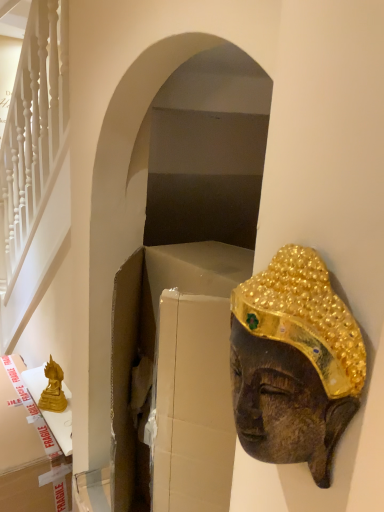
Question: Does gold matte statue at lower left contain gold cardboard box at left?

Choices:
 (A) yes
 (B) no

Answer: (B)

Question: Does gold matte statue at lower left have a greater width compared to gold cardboard box at left?

Choices:
 (A) no
 (B) yes

Answer: (A)

Question: Is gold matte statue at lower left oriented towards gold cardboard box at left?

Choices:
 (A) no
 (B) yes

Answer: (A)

Question: Is gold matte statue at lower left smaller than gold cardboard box at left?

Choices:
 (A) yes
 (B) no

Answer: (A)

Question: Is gold matte statue at lower left shorter than gold cardboard box at left?

Choices:
 (A) yes
 (B) no

Answer: (A)

Question: Is gold matte statue at lower left in contact with gold cardboard box at left?

Choices:
 (A) yes
 (B) no

Answer: (B)

Question: From the image's perspective, is gold textured mask at right located beneath gold matte statue at lower left?

Choices:
 (A) yes
 (B) no

Answer: (B)

Question: Is gold matte statue at lower left a part of gold textured mask at right?

Choices:
 (A) no
 (B) yes

Answer: (A)

Question: Is gold textured mask at right directly adjacent to gold matte statue at lower left?

Choices:
 (A) yes
 (B) no

Answer: (B)

Question: Does gold textured mask at right have a greater height compared to gold matte statue at lower left?

Choices:
 (A) no
 (B) yes

Answer: (A)

Question: Does gold textured mask at right appear on the right side of gold matte statue at lower left?

Choices:
 (A) no
 (B) yes

Answer: (B)

Question: Can you confirm if gold textured mask at right is thinner than gold matte statue at lower left?

Choices:
 (A) no
 (B) yes

Answer: (B)

Question: From a real-world perspective, is gold cardboard box at left located beneath gold matte statue at lower left?

Choices:
 (A) no
 (B) yes

Answer: (B)